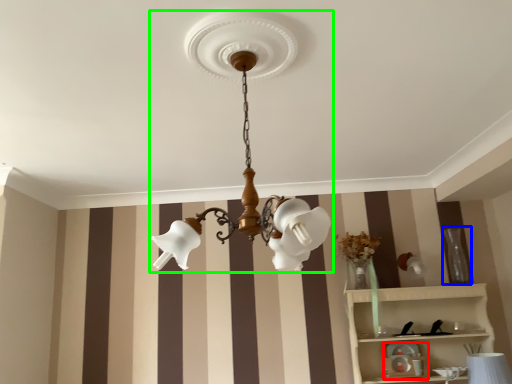
Question: Considering the real-world distances, which object is farthest from toy (highlighted by a red box)? vase (highlighted by a blue box) or lamp (highlighted by a green box)?

Choices:
 (A) vase
 (B) lamp

Answer: (B)